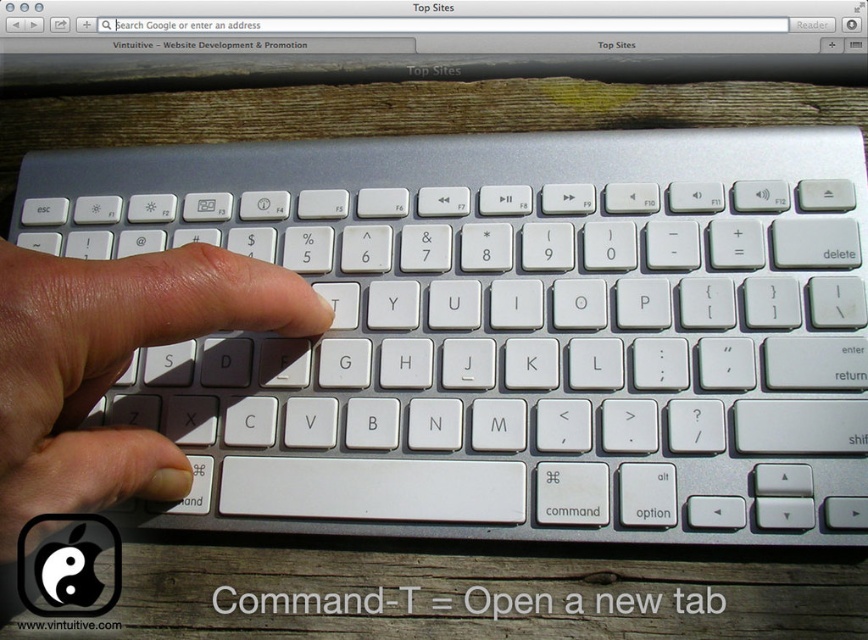
You are a person with a 24 inch arm length. You want to reach the satin silver computer screen at upper center from your current position. Can you reach it?

The satin silver computer screen at upper center and viewer are 23.68 inches apart. Since your arm is 24 inches long, you can reach the satin silver computer screen at upper center.